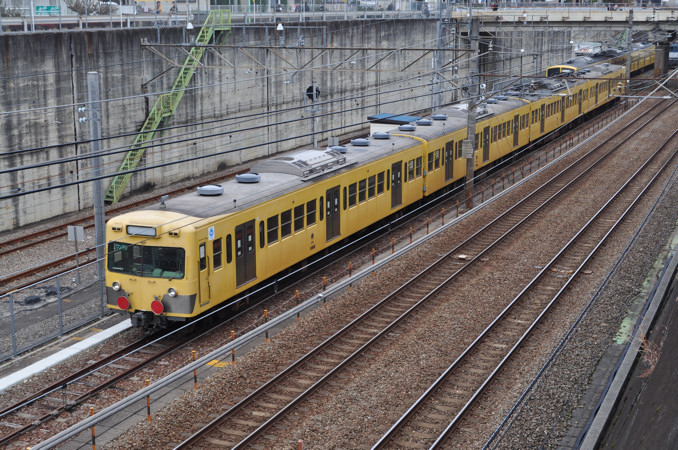
Find the location of `wall on the bottom right`. wall on the bottom right is located at coordinates (655, 412).